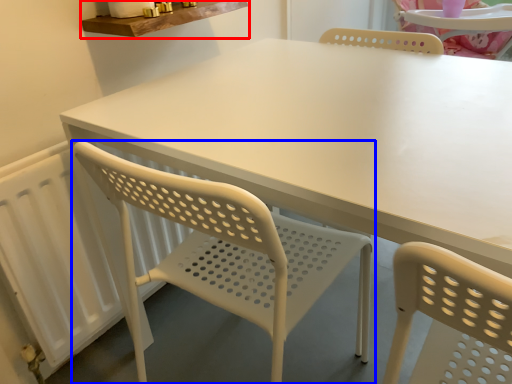
Question: Which point is closer to the camera, counter top (highlighted by a red box) or chair (highlighted by a blue box)?

Choices:
 (A) counter top
 (B) chair

Answer: (B)